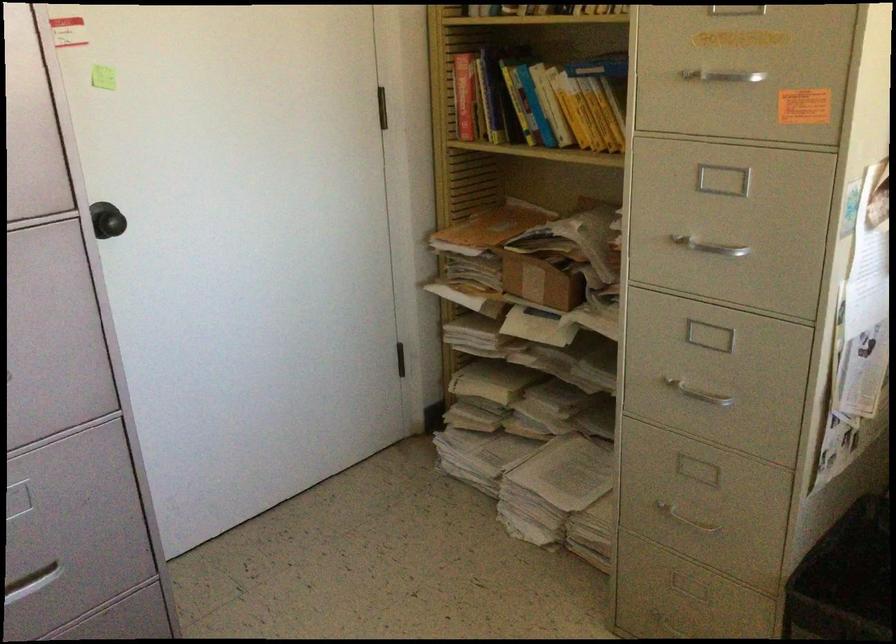
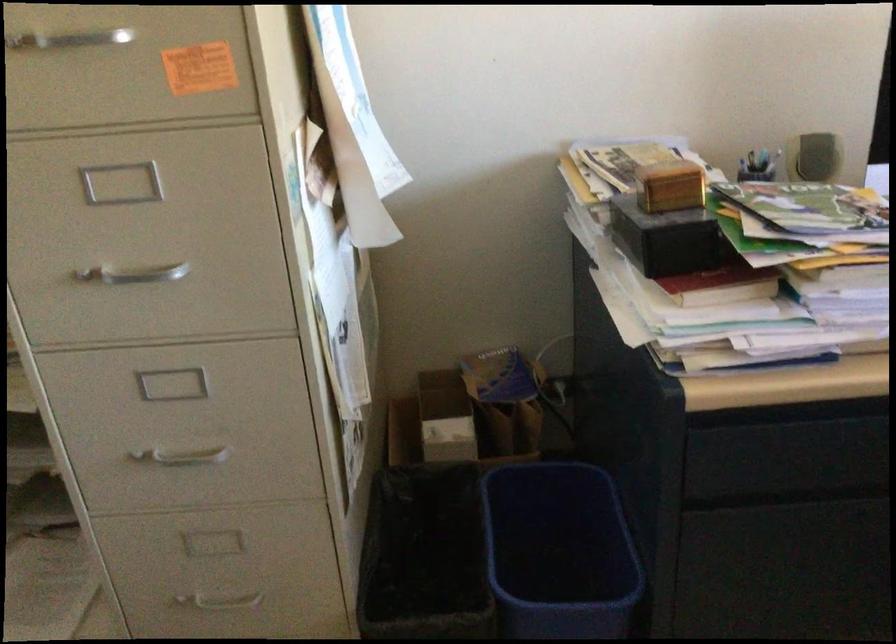
In the second image, find the point that corresponds to pixel 676 513 in the first image.

(216, 601)